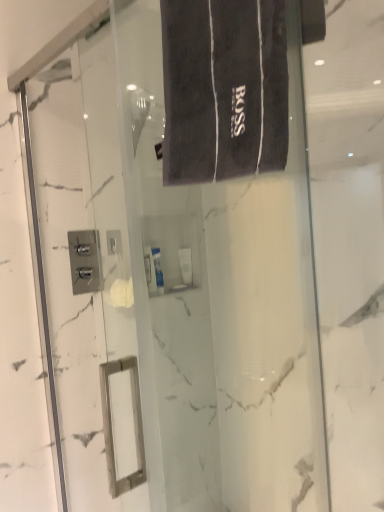
Question: Considering the relative positions of dark gray terry cloth bath towel at upper center and white glossy tube at center, the first toiletry from the front, in the image provided, is dark gray terry cloth bath towel at upper center to the right of white glossy tube at center, the first toiletry from the front, from the viewer's perspective?

Choices:
 (A) yes
 (B) no

Answer: (A)

Question: Does dark gray terry cloth bath towel at upper center have a lesser height compared to white glossy tube at center, which ranks as the second toiletry in back-to-front order?

Choices:
 (A) yes
 (B) no

Answer: (B)

Question: Is dark gray terry cloth bath towel at upper center bigger than white glossy tube at center, which ranks as the second toiletry in back-to-front order?

Choices:
 (A) yes
 (B) no

Answer: (A)

Question: From the image's perspective, is dark gray terry cloth bath towel at upper center over white glossy tube at center, the first toiletry from the front?

Choices:
 (A) yes
 (B) no

Answer: (A)

Question: Is dark gray terry cloth bath towel at upper center taller than white glossy tube at center, which ranks as the second toiletry in back-to-front order?

Choices:
 (A) no
 (B) yes

Answer: (B)

Question: Does dark gray terry cloth bath towel at upper center lie in front of white glossy tube at center, which ranks as the second toiletry in back-to-front order?

Choices:
 (A) yes
 (B) no

Answer: (A)

Question: Considering the relative positions of white glossy tube at center, which ranks as the second toiletry in back-to-front order, and white glossy tube at center, which is the 1th toiletry in back-to-front order, in the image provided, is white glossy tube at center, which ranks as the second toiletry in back-to-front order, to the right of white glossy tube at center, which is the 1th toiletry in back-to-front order, from the viewer's perspective?

Choices:
 (A) no
 (B) yes

Answer: (A)

Question: Could you tell me if white glossy tube at center, the first toiletry from the front, is turned towards white glossy tube at center, which is the 1th toiletry in back-to-front order?

Choices:
 (A) no
 (B) yes

Answer: (A)

Question: From the image's perspective, would you say white glossy tube at center, the first toiletry from the front, is positioned over white glossy tube at center, marked as the second toiletry in a front-to-back arrangement?

Choices:
 (A) no
 (B) yes

Answer: (B)

Question: From the image's perspective, would you say white glossy tube at center, the first toiletry from the front, is shown under white glossy tube at center, marked as the second toiletry in a front-to-back arrangement?

Choices:
 (A) yes
 (B) no

Answer: (B)

Question: Is the depth of white glossy tube at center, the first toiletry from the front, greater than that of white glossy tube at center, marked as the second toiletry in a front-to-back arrangement?

Choices:
 (A) no
 (B) yes

Answer: (A)

Question: From a real-world perspective, is white glossy tube at center, which ranks as the second toiletry in back-to-front order, positioned over white glossy tube at center, which is the 1th toiletry in back-to-front order, based on gravity?

Choices:
 (A) no
 (B) yes

Answer: (B)

Question: Is white glossy tube at center, marked as the second toiletry in a front-to-back arrangement, bigger than dark gray terry cloth bath towel at upper center?

Choices:
 (A) yes
 (B) no

Answer: (B)